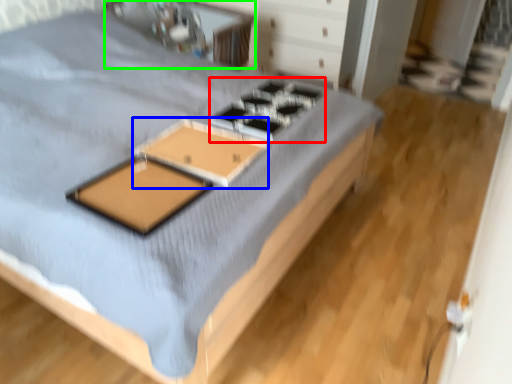
Question: Based on their relative distances, which object is nearer to gas stove (highlighted by a red box)? Choose from table (highlighted by a blue box) and table (highlighted by a green box).

Choices:
 (A) table
 (B) table

Answer: (A)